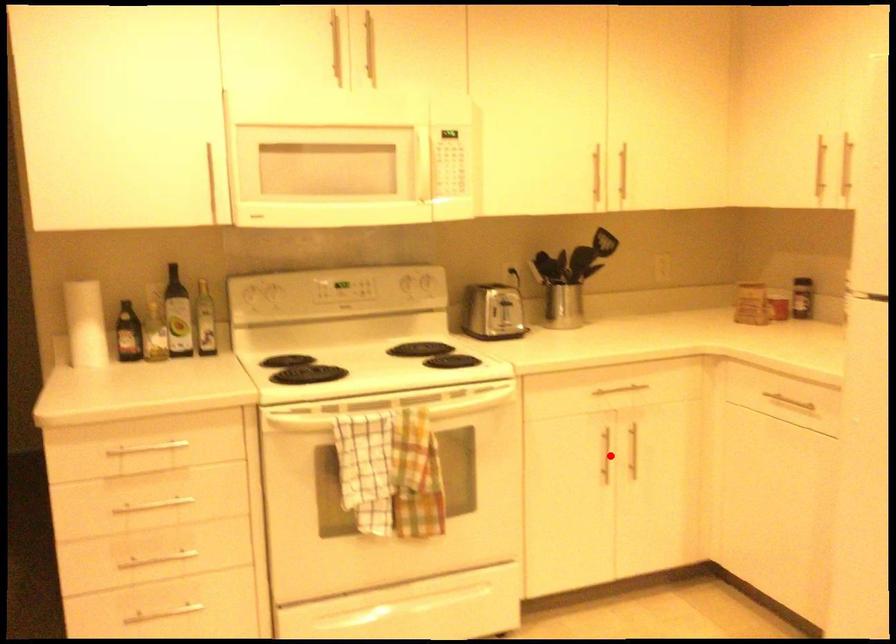
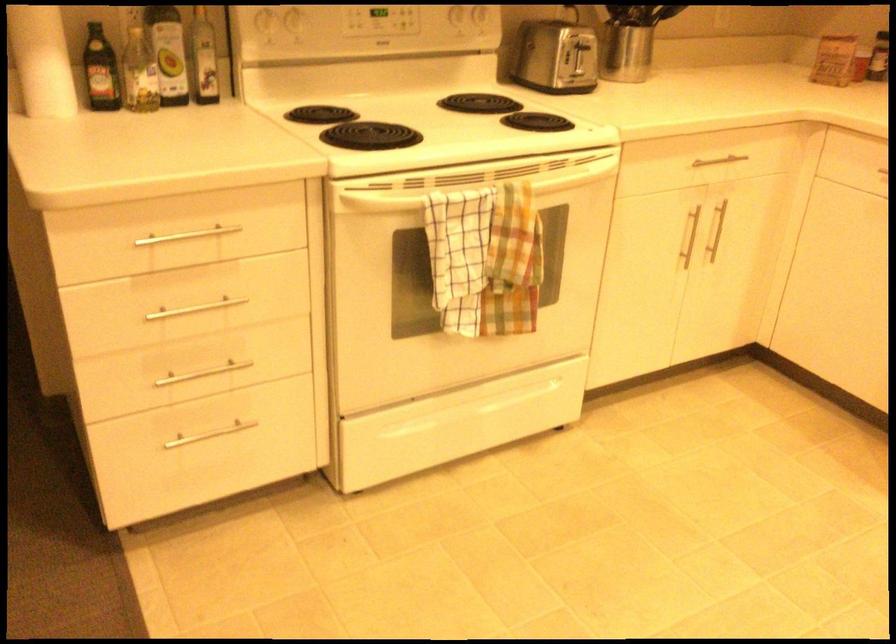
The point at the highlighted location is marked in the first image. Where is the corresponding point in the second image?

(687, 237)